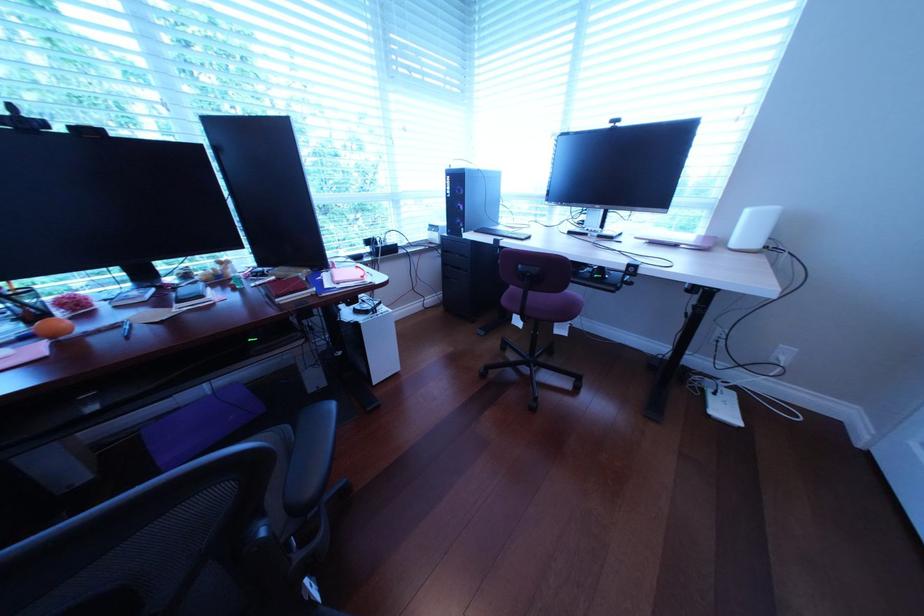
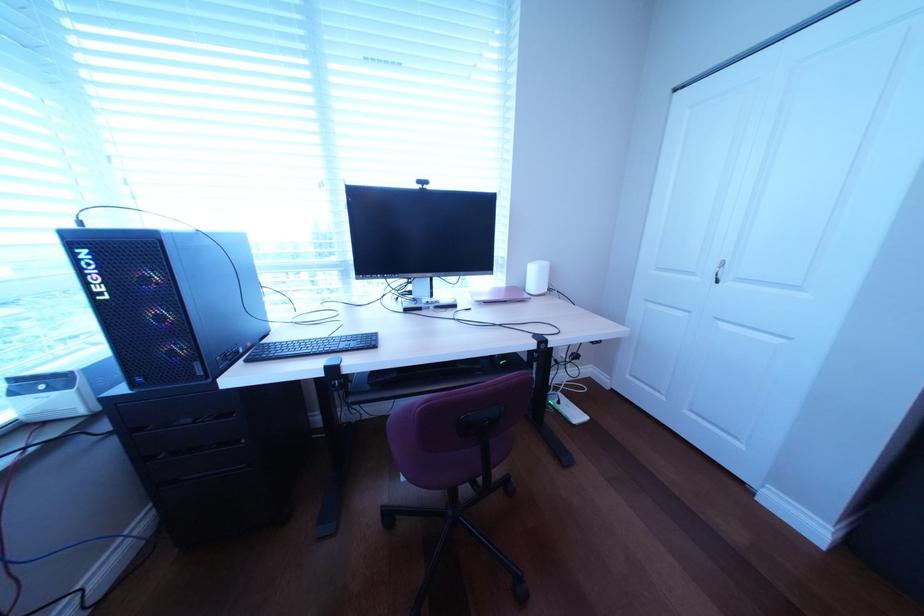
Question: The camera is either moving clockwise (left) or counter-clockwise (right) around the object. The first image is from the beginning of the video and the second image is from the end. Is the camera moving left or right when shooting the video?

Choices:
 (A) Left
 (B) Right

Answer: (A)